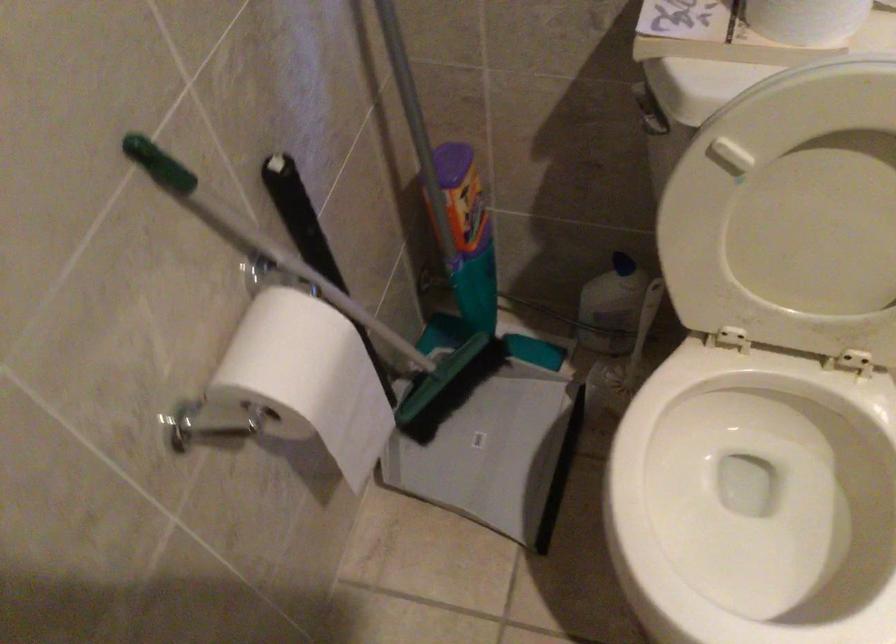
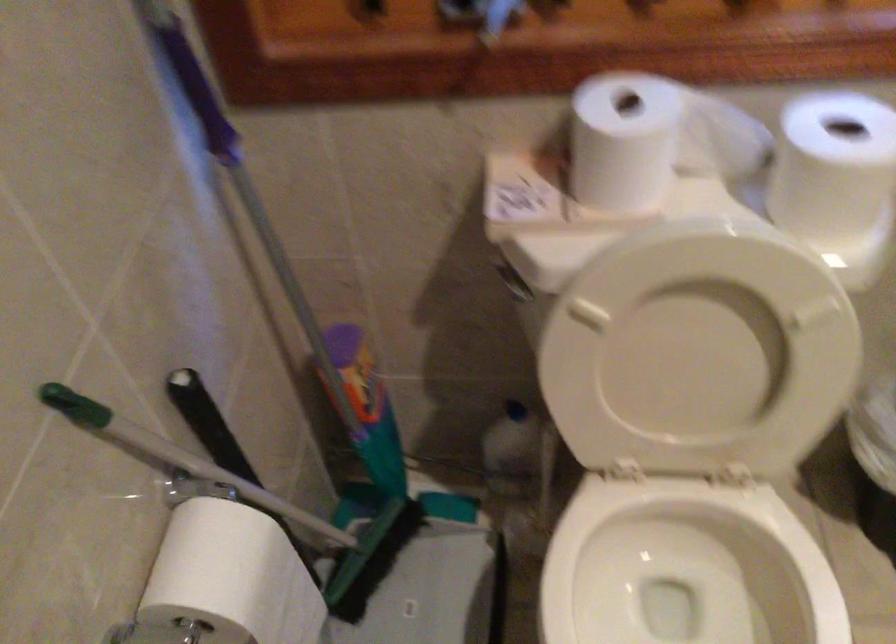
The point at (286,187) is marked in the first image. Where is the corresponding point in the second image?

(194, 402)